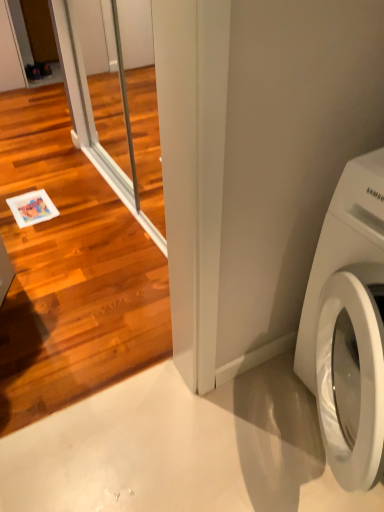
Locate an element on the screen. The image size is (384, 512). free space in front of clear glass screen door at upper left, the 1th screen door positioned from the front is located at coordinates (105, 480).